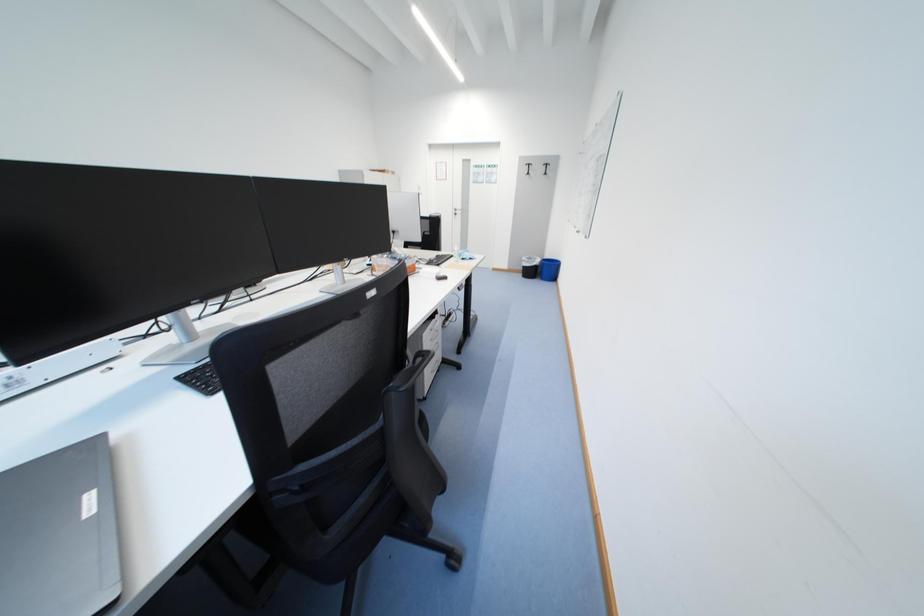
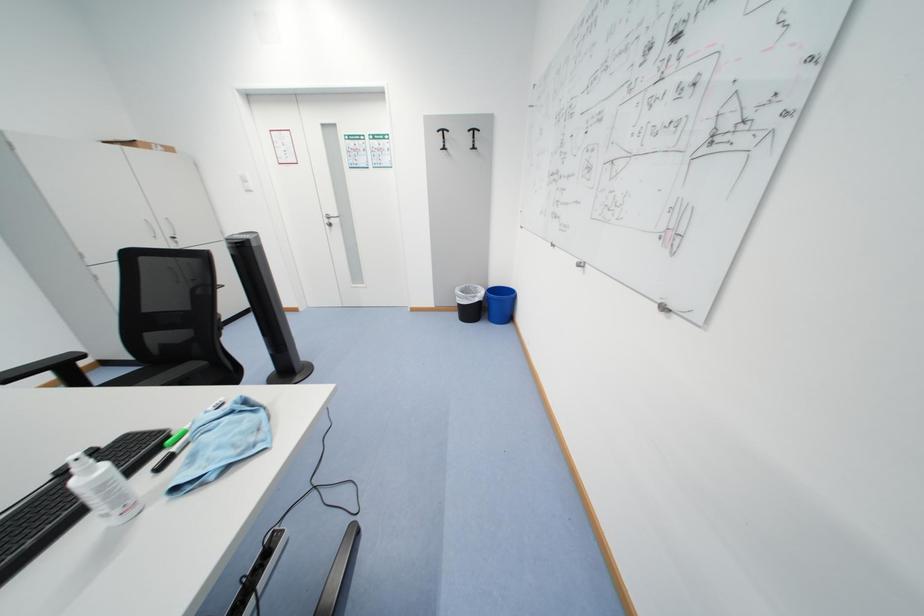
Question: What movement of the cameraman would produce the second image?

Choices:
 (A) Left
 (B) Right
 (C) Forward
 (D) Backward

Answer: (C)